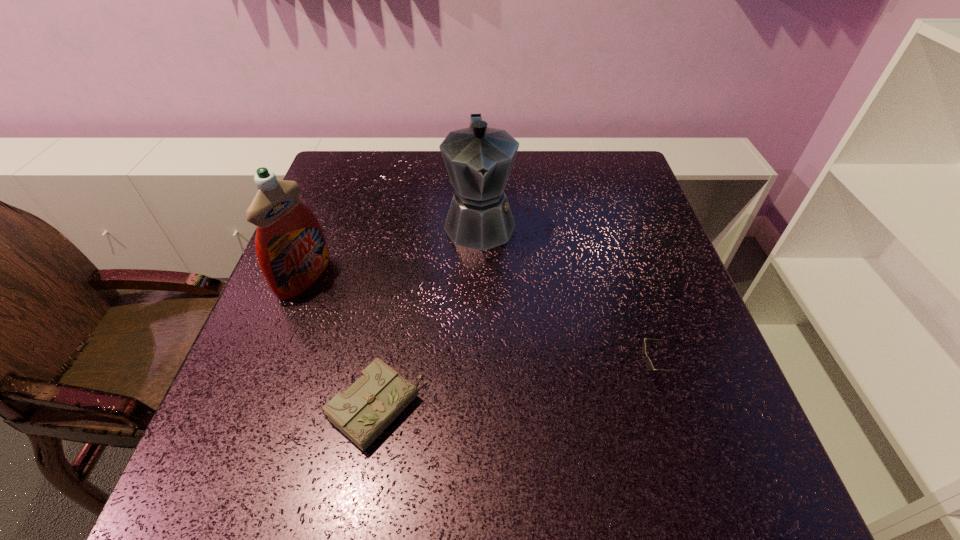
The height and width of the screenshot is (540, 960). Find the location of `blank area located on the front surface of the detergent`. blank area located on the front surface of the detergent is located at coordinates (472, 359).

At what (x,y) coordinates should I click in order to perform the action: click on vacant point located on the front surface of the detergent. Please return your answer as a coordinate pair (x, y). Looking at the image, I should click on (437, 343).

This screenshot has width=960, height=540. What are the coordinates of `vacant space situated 0.280m on the front surface of the detergent` in the screenshot? It's located at (428, 339).

Image resolution: width=960 pixels, height=540 pixels. Find the location of `vacant space situated at the spout of the second object from right to left`. vacant space situated at the spout of the second object from right to left is located at coordinates (488, 309).

Identify the location of free location located at the spout of the second object from right to left. (497, 390).

Locate an element on the screen. vacant space located 0.170m at the spout of the second object from right to left is located at coordinates (489, 313).

At what (x,y) coordinates should I click in order to perform the action: click on object situated at the far edge. Please return your answer as a coordinate pair (x, y). The width and height of the screenshot is (960, 540). Looking at the image, I should click on (478, 159).

Identify the location of diary at the near edge. The width and height of the screenshot is (960, 540). (376, 399).

The image size is (960, 540). Find the location of `sunglasses present at the near edge`. sunglasses present at the near edge is located at coordinates (649, 365).

The height and width of the screenshot is (540, 960). What are the coordinates of `object present at the left edge` in the screenshot? It's located at (292, 252).